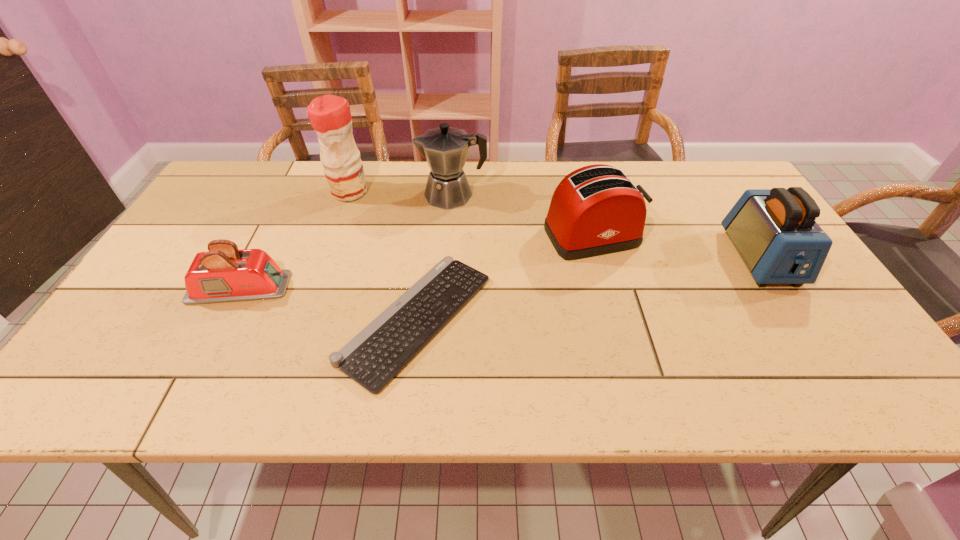
I want to click on vacant space located at the spout of the coffeepot, so click(x=358, y=195).

The image size is (960, 540). Identify the location of vacant space located at the spout of the coffeepot. (338, 195).

This screenshot has width=960, height=540. Find the location of `free spot located 0.270m on the front-facing side of the rightmost toaster`. free spot located 0.270m on the front-facing side of the rightmost toaster is located at coordinates (848, 394).

The width and height of the screenshot is (960, 540). Find the location of `vacant space positioned 0.170m on the left of the second toaster from right to left`. vacant space positioned 0.170m on the left of the second toaster from right to left is located at coordinates (482, 236).

You are a GUI agent. You are given a task and a screenshot of the screen. Output one action in this format:
    pyautogui.click(x=<x>, y=<y>)
    Task: Click on the vacant space located 0.050m on the left of the fifth tallest object
    The image size is (960, 540).
    Given the screenshot: What is the action you would take?
    pyautogui.click(x=169, y=288)

Identify the location of vacant space located 0.320m on the back of the shortest object. This screenshot has width=960, height=540. [433, 187].

Locate an element on the screen. condiment at the far edge is located at coordinates (330, 116).

The height and width of the screenshot is (540, 960). Find the location of `coffeepot positioned at the far edge`. coffeepot positioned at the far edge is located at coordinates 445,148.

The width and height of the screenshot is (960, 540). What are the coordinates of `object present at the near edge` in the screenshot? It's located at (376, 354).

Identify the location of object that is at the left edge. (224, 274).